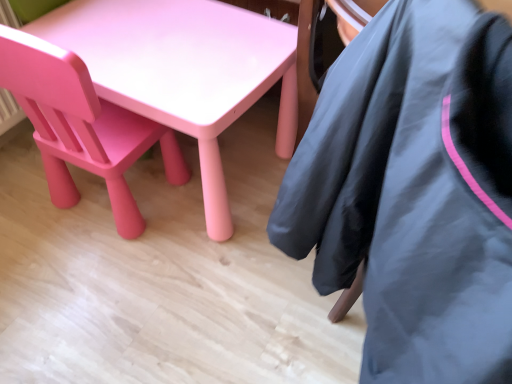
Question: Is matte black jacket at lower right wider than matte pink plastic chair at lower left?

Choices:
 (A) yes
 (B) no

Answer: (A)

Question: Can you confirm if matte black jacket at lower right is positioned to the left of matte pink plastic chair at lower left?

Choices:
 (A) yes
 (B) no

Answer: (B)

Question: Could you tell me if matte black jacket at lower right is turned towards matte pink plastic chair at lower left?

Choices:
 (A) yes
 (B) no

Answer: (B)

Question: From the image's perspective, is matte black jacket at lower right under matte pink plastic chair at lower left?

Choices:
 (A) yes
 (B) no

Answer: (A)

Question: Considering the relative sizes of matte black jacket at lower right and matte pink plastic chair at lower left in the image provided, is matte black jacket at lower right shorter than matte pink plastic chair at lower left?

Choices:
 (A) yes
 (B) no

Answer: (B)

Question: Is matte black jacket at lower right thinner than matte pink plastic chair at lower left?

Choices:
 (A) no
 (B) yes

Answer: (A)

Question: Is matte pink plastic chair at lower left outside of matte black jacket at lower right?

Choices:
 (A) no
 (B) yes

Answer: (B)

Question: Does matte pink plastic chair at lower left have a greater width compared to matte black jacket at lower right?

Choices:
 (A) yes
 (B) no

Answer: (B)

Question: Is matte pink plastic chair at lower left at the right side of matte black jacket at lower right?

Choices:
 (A) no
 (B) yes

Answer: (A)

Question: Does matte pink plastic chair at lower left have a lesser width compared to matte black jacket at lower right?

Choices:
 (A) no
 (B) yes

Answer: (B)

Question: Is matte pink plastic chair at lower left smaller than matte black jacket at lower right?

Choices:
 (A) no
 (B) yes

Answer: (B)

Question: Does matte pink plastic chair at lower left lie behind matte black jacket at lower right?

Choices:
 (A) no
 (B) yes

Answer: (B)

Question: Looking at their shapes, would you say matte black jacket at lower right is wider or thinner than matte pink plastic chair at lower left?

Choices:
 (A) thin
 (B) wide

Answer: (B)